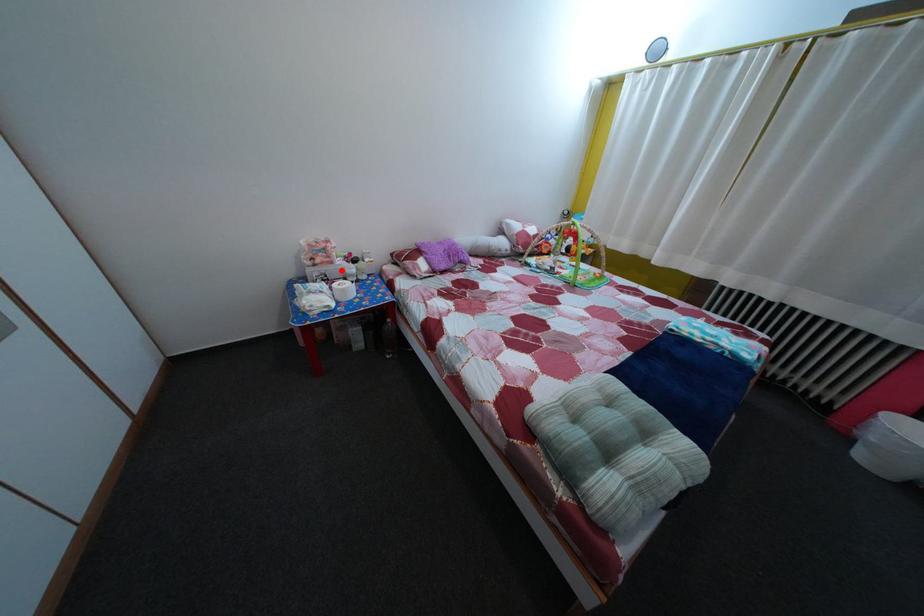
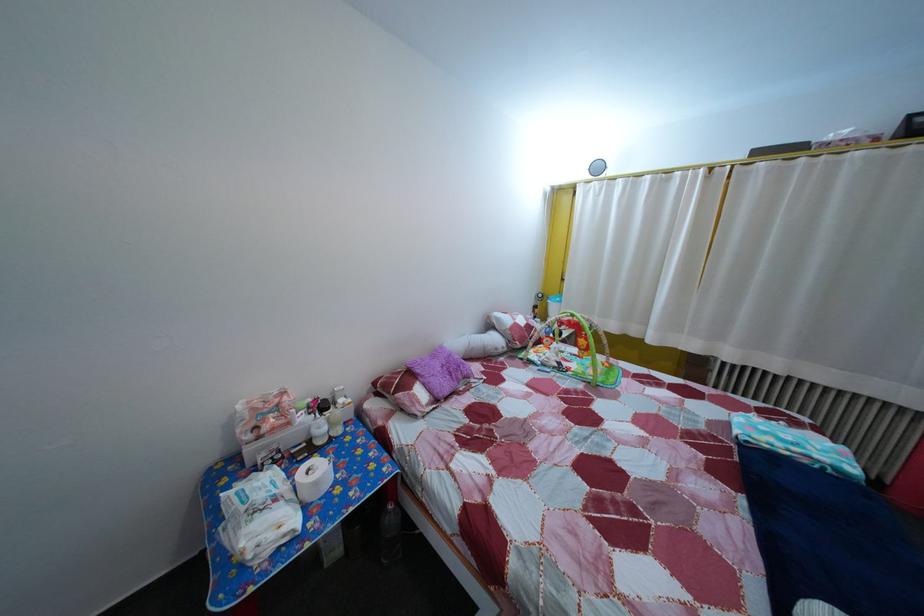
Question: I am providing you with two images of the same scene from different viewpoints. A red point is shown in image1. For the corresponding object point in image2, is it positioned nearer or farther from the camera?

Choices:
 (A) Nearer
 (B) Farther

Answer: (B)